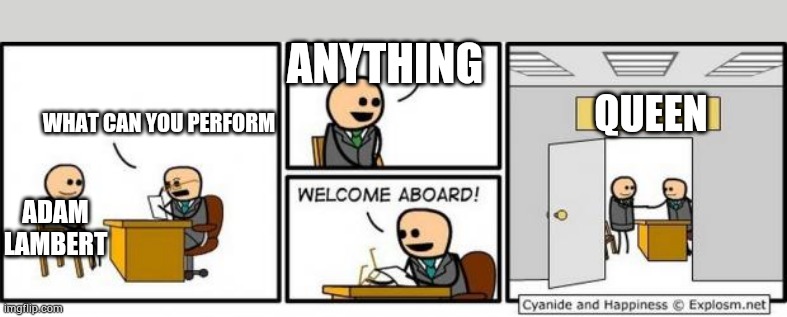
The height and width of the screenshot is (317, 787). What are the coordinates of `ceiling tiles` in the screenshot? It's located at (541, 50), (649, 54), (737, 61).